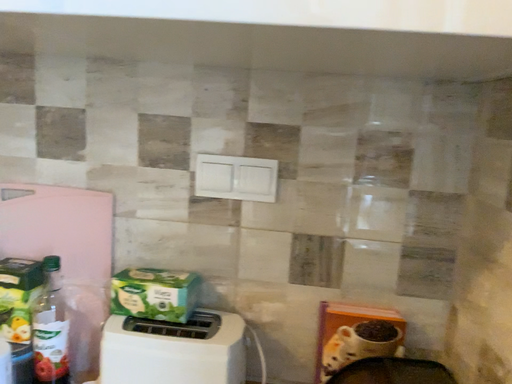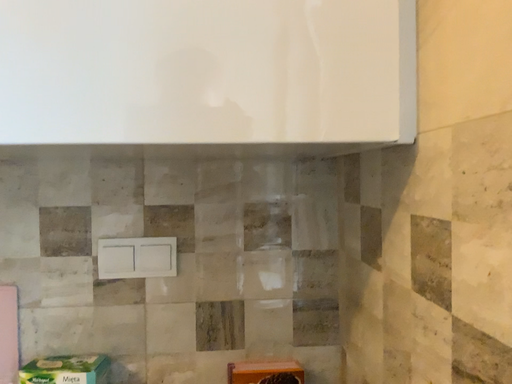
Question: Which way did the camera rotate in the video?

Choices:
 (A) rotated upward
 (B) rotated downward

Answer: (A)